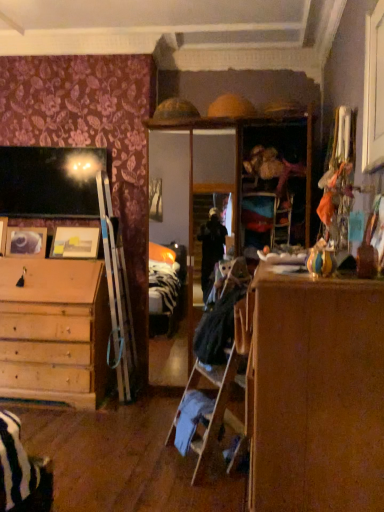
Question: Is black fabric laundry at center positioned beyond the bounds of wooden photo frame at left, marked as the second picture frame in a right-to-left arrangement?

Choices:
 (A) no
 (B) yes

Answer: (B)

Question: Considering the relative sizes of black fabric laundry at center and wooden photo frame at left, marked as the second picture frame in a right-to-left arrangement, in the image provided, is black fabric laundry at center smaller than wooden photo frame at left, marked as the second picture frame in a right-to-left arrangement,?

Choices:
 (A) yes
 (B) no

Answer: (B)

Question: From a real-world perspective, is black fabric laundry at center under wooden photo frame at left, which appears as the 1th picture frame when viewed from the left?

Choices:
 (A) yes
 (B) no

Answer: (A)

Question: From a real-world perspective, is black fabric laundry at center over wooden photo frame at left, marked as the second picture frame in a right-to-left arrangement?

Choices:
 (A) no
 (B) yes

Answer: (A)

Question: Is black fabric laundry at center far from wooden photo frame at left, which appears as the 1th picture frame when viewed from the left?

Choices:
 (A) no
 (B) yes

Answer: (B)

Question: Would you say black fabric laundry at center is to the left or to the right of wooden photo frame at left, marked as the second picture frame in a right-to-left arrangement, in the picture?

Choices:
 (A) right
 (B) left

Answer: (A)

Question: Looking at their shapes, would you say black fabric laundry at center is wider or thinner than wooden photo frame at left, marked as the second picture frame in a right-to-left arrangement?

Choices:
 (A) thin
 (B) wide

Answer: (B)

Question: From the image's perspective, is black fabric laundry at center positioned above or below wooden photo frame at left, marked as the second picture frame in a right-to-left arrangement?

Choices:
 (A) below
 (B) above

Answer: (A)

Question: Relative to wooden photo frame at left, which appears as the 1th picture frame when viewed from the left, is black fabric laundry at center in front or behind?

Choices:
 (A) front
 (B) behind

Answer: (A)

Question: Considering the relative positions of brown wood dresser at center and wooden photo frame at left, which appears as the 1th picture frame when viewed from the left, in the image provided, is brown wood dresser at center to the left or to the right of wooden photo frame at left, which appears as the 1th picture frame when viewed from the left,?

Choices:
 (A) right
 (B) left

Answer: (A)

Question: From their relative heights in the image, would you say brown wood dresser at center is taller or shorter than wooden photo frame at left, which appears as the 1th picture frame when viewed from the left?

Choices:
 (A) tall
 (B) short

Answer: (A)

Question: From the image's perspective, relative to wooden photo frame at left, which appears as the 1th picture frame when viewed from the left, is brown wood dresser at center above or below?

Choices:
 (A) below
 (B) above

Answer: (A)

Question: Which is correct: brown wood dresser at center is inside wooden photo frame at left, which appears as the 1th picture frame when viewed from the left, or outside of it?

Choices:
 (A) inside
 (B) outside

Answer: (B)

Question: Based on their positions, is wooden photo frame at left, which appears as the 1th picture frame when viewed from the left, located to the left or right of brown wood dresser at center?

Choices:
 (A) left
 (B) right

Answer: (A)

Question: Looking at their shapes, would you say wooden photo frame at left, marked as the second picture frame in a right-to-left arrangement, is wider or thinner than brown wood dresser at center?

Choices:
 (A) wide
 (B) thin

Answer: (B)